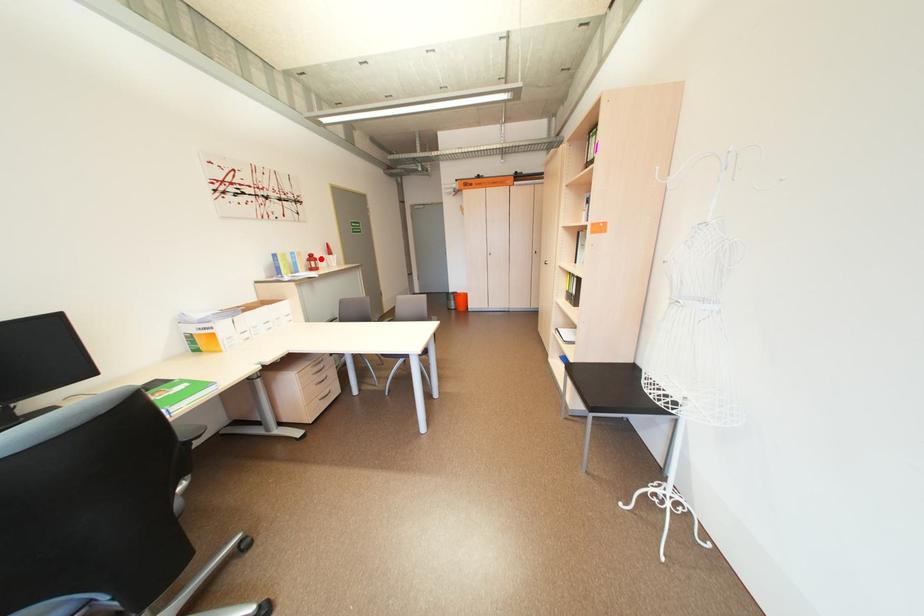
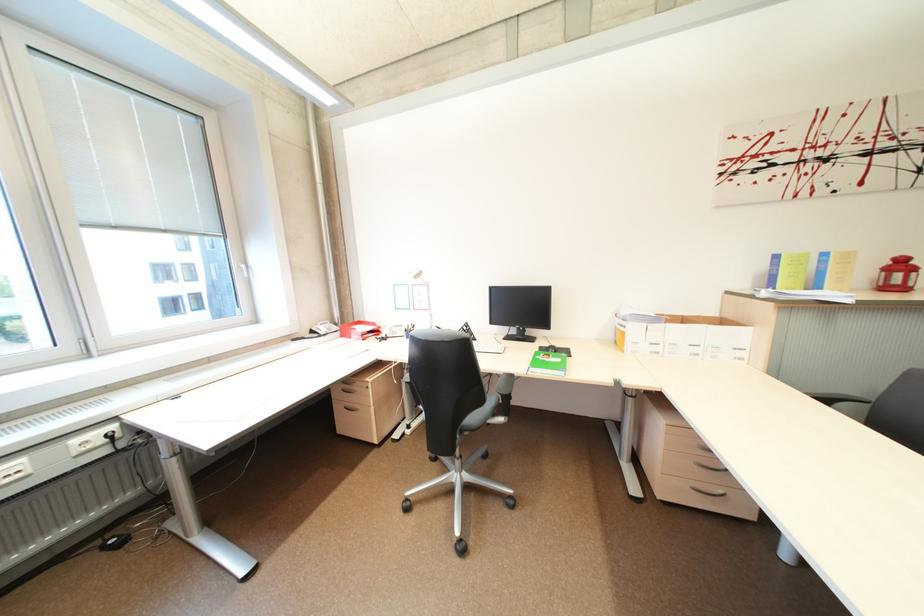
Find the pixel in the second image that matches the highlighted location in the first image.

(910, 265)